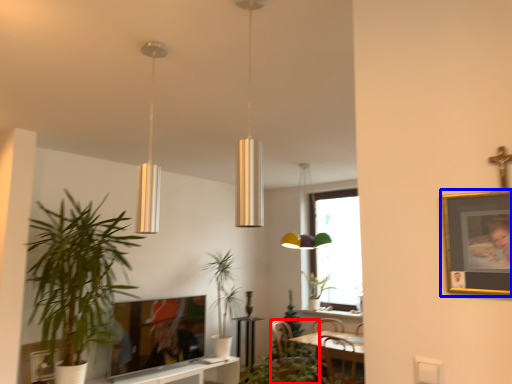
Question: Which point is further to the camera, swivel chair (highlighted by a red box) or picture frame (highlighted by a blue box)?

Choices:
 (A) swivel chair
 (B) picture frame

Answer: (A)